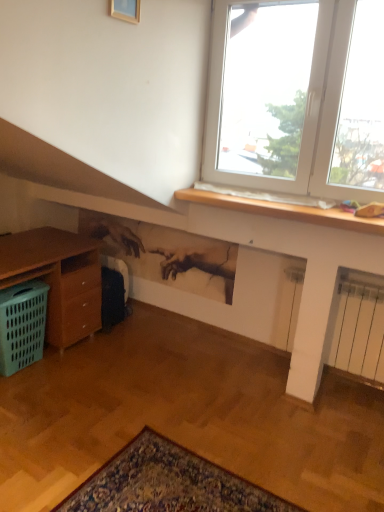
Question: Is green plastic basket at lower left located outside gold wooden picture frame at upper center?

Choices:
 (A) no
 (B) yes

Answer: (B)

Question: Is green plastic basket at lower left bigger than gold wooden picture frame at upper center?

Choices:
 (A) yes
 (B) no

Answer: (A)

Question: Can you confirm if green plastic basket at lower left is wider than gold wooden picture frame at upper center?

Choices:
 (A) yes
 (B) no

Answer: (A)

Question: Considering the relative sizes of green plastic basket at lower left and gold wooden picture frame at upper center in the image provided, is green plastic basket at lower left smaller than gold wooden picture frame at upper center?

Choices:
 (A) yes
 (B) no

Answer: (B)

Question: Does green plastic basket at lower left have a lesser height compared to gold wooden picture frame at upper center?

Choices:
 (A) no
 (B) yes

Answer: (A)

Question: Could you tell me if green plastic basket at lower left is facing gold wooden picture frame at upper center?

Choices:
 (A) no
 (B) yes

Answer: (A)

Question: Does gold wooden picture frame at upper center have a lesser height compared to green plastic basket at lower left?

Choices:
 (A) no
 (B) yes

Answer: (B)

Question: Is gold wooden picture frame at upper center positioned beyond the bounds of green plastic basket at lower left?

Choices:
 (A) no
 (B) yes

Answer: (B)

Question: Is the position of gold wooden picture frame at upper center more distant than that of green plastic basket at lower left?

Choices:
 (A) yes
 (B) no

Answer: (B)

Question: Does gold wooden picture frame at upper center have a greater width compared to green plastic basket at lower left?

Choices:
 (A) yes
 (B) no

Answer: (B)

Question: Is gold wooden picture frame at upper center looking in the opposite direction of green plastic basket at lower left?

Choices:
 (A) yes
 (B) no

Answer: (B)

Question: Could green plastic basket at lower left be considered to be inside gold wooden picture frame at upper center?

Choices:
 (A) yes
 (B) no

Answer: (B)

Question: Considering the positions of point (127, 12) and point (6, 327), is point (127, 12) closer or farther from the camera than point (6, 327)?

Choices:
 (A) farther
 (B) closer

Answer: (B)